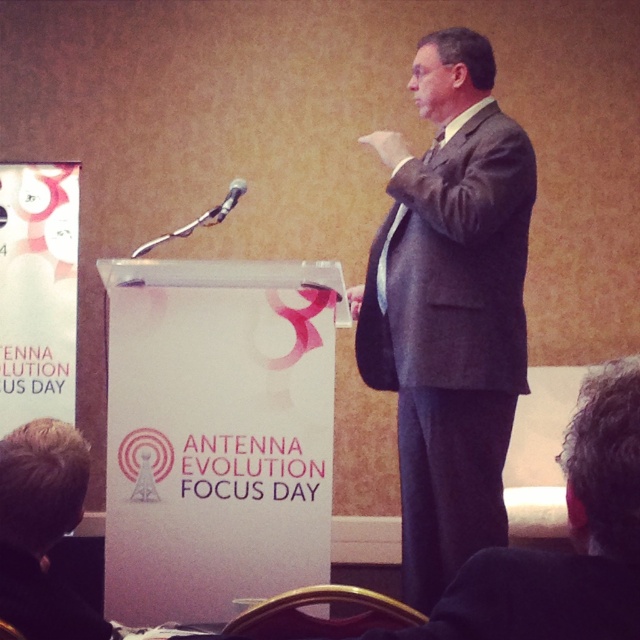
Which of these two, matte gray suit at center or black plastic microphone at upper center, stands taller?

With more height is matte gray suit at center.

Who is lower down, matte gray suit at center or black plastic microphone at upper center?

matte gray suit at center is lower down.

Which is in front, point (401, 435) or point (220, 209)?

Point (401, 435) is in front.

At what (x,y) coordinates should I click in order to perform the action: click on matte gray suit at center. Please return your answer as a coordinate pair (x, y). This screenshot has width=640, height=640. Looking at the image, I should click on (449, 307).